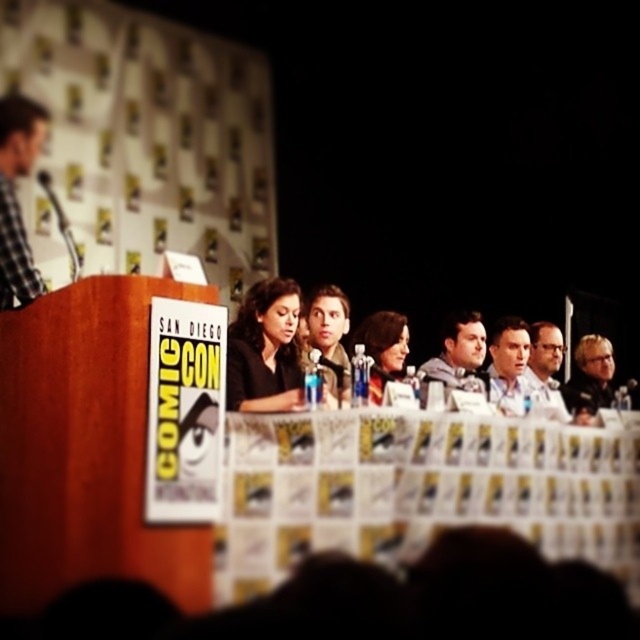
Is white paper at center bigger than blonde hair at right?

Indeed, white paper at center has a larger size compared to blonde hair at right.

Does point (314, 547) come closer to viewer compared to point (588, 358)?

Yes, point (314, 547) is in front of point (588, 358).

Find the location of a particular element. Image resolution: width=640 pixels, height=640 pixels. white paper at center is located at coordinates (420, 490).

Consider the image. Does white paper at center lie behind gray fabric jacket at center?

That is False.

Does point (582, 492) lie behind point (426, 380)?

No, it is in front of (426, 380).

Is point (316, 445) farther from camera compared to point (452, 352)?

No.

In order to click on white paper at center in this screenshot , I will do `click(420, 490)`.

Does checkered fabric shirt at left have a greater height compared to blonde hair at right?

Yes.

Is checkered fabric shirt at left positioned behind blonde hair at right?

No, checkered fabric shirt at left is closer to the viewer.

Identify the location of checkered fabric shirt at left. This screenshot has width=640, height=640. (16, 196).

At what (x,y) coordinates should I click in order to perform the action: click on checkered fabric shirt at left. Please return your answer as a coordinate pair (x, y). The image size is (640, 640). Looking at the image, I should click on (16, 196).